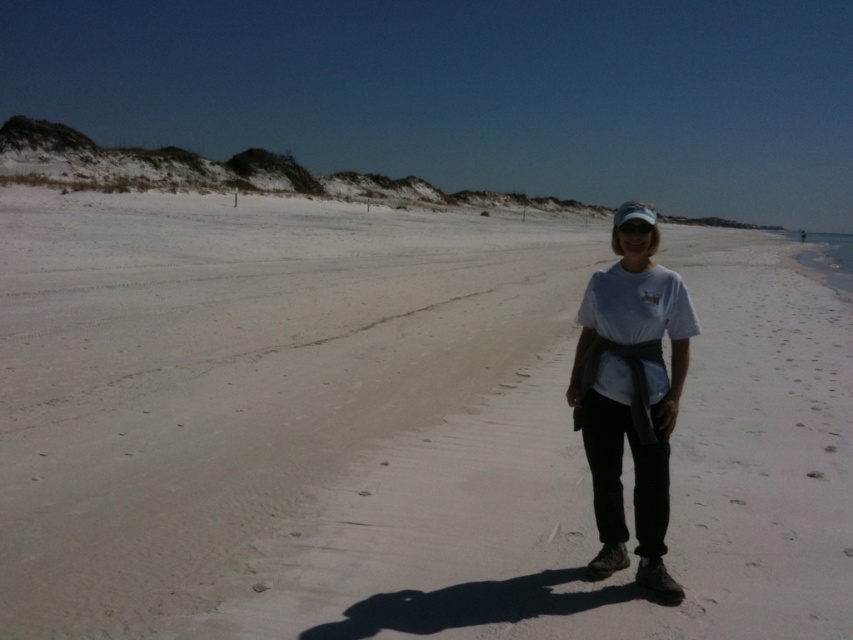
You are a photographer trying to capture the perfect shot of the white cotton shirt at center. The camera you are using has a focal length of 50mm. Based on the coordinates provided, can you determine if the shirt is positioned within the recommended framing area for a centered subject? The recommended framing area is between points 0.5 and 0.55 on both the x and y axes.

The white cotton shirt at center is positioned at coordinates 0.623 on the x and 0.740 on the y. Since both values exceed the recommended 0.5 to 0.55 range, the shirt is outside the recommended framing area for a centered subject.

You are standing on the beach and see a person wearing a white cotton shirt at center and white sand at center. Which object is located to the right of the other?

The white sand at center is positioned on the right side of white cotton shirt at center.